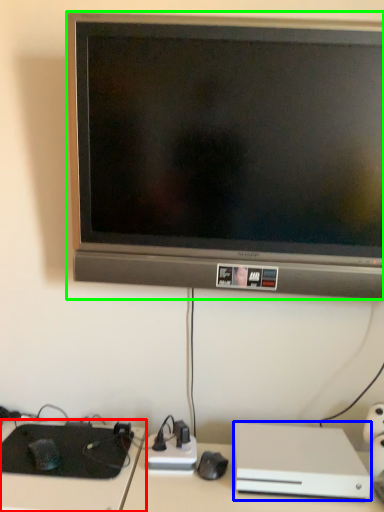
Question: Which object is the farthest from computer desk (highlighted by a red box)? Choose among these: computer (highlighted by a blue box) or television (highlighted by a green box).

Choices:
 (A) computer
 (B) television

Answer: (B)